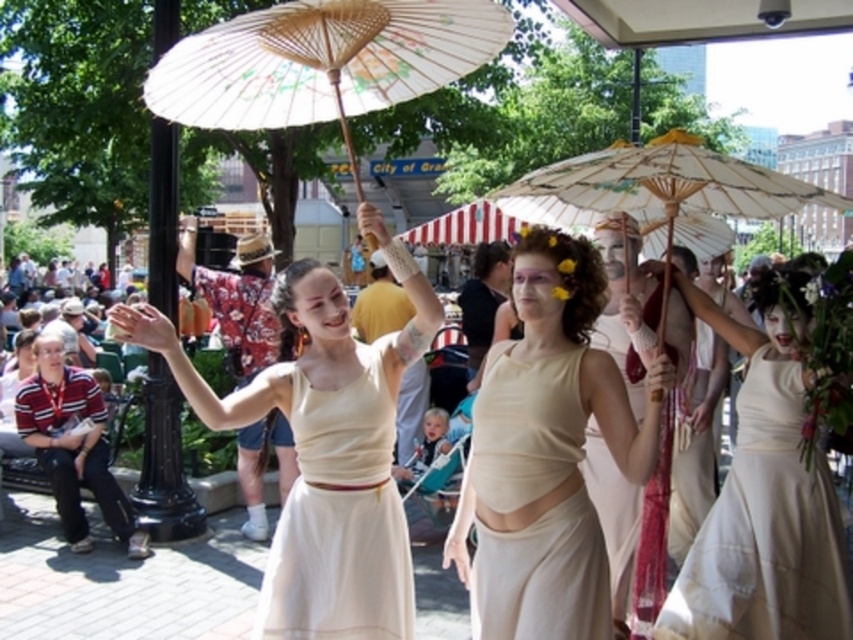
You are organizing a parade and need to ensure that the two dresses, the matte cream dress at center and the beige fabric dress at center, can fit side by side in a display case that is 1.8 meters wide. Given their widths, will they both fit comfortably without overlapping?

The matte cream dress at center is wider than the beige fabric dress at center. However, without specific measurements, it is impossible to determine if their combined widths will fit within the 1.8 meters. Additional information about each dress width is needed to confirm.

You are a photographer positioned in front of the striped canopy tent and want to take a photo of both the matte cream dress at center and the beige fabric dress at center. Which dress should you focus on first to ensure it appears sharp in the photo?

You should focus on the matte cream dress at center first because it is closer to you than the beige fabric dress at center, ensuring it stays sharp in the photo.

You are an attendee at the festival and want to take a photo of both the white cotton dress at center and the beige fabric dress at center. Which dress should you focus on first to ensure both are in the frame?

You should focus on the white cotton dress at center first since it is closer to you than the beige fabric dress at center, ensuring both will be in the frame when properly focused.